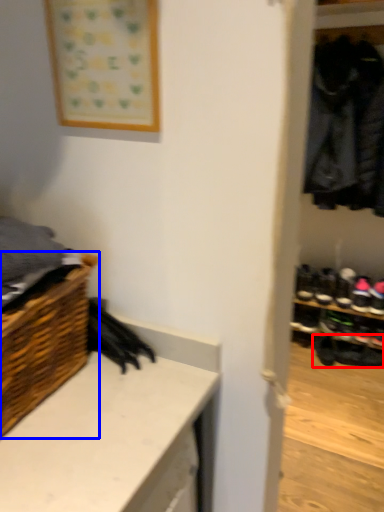
Question: Which point is further to the camera, footwear (highlighted by a red box) or shelf (highlighted by a blue box)?

Choices:
 (A) footwear
 (B) shelf

Answer: (A)